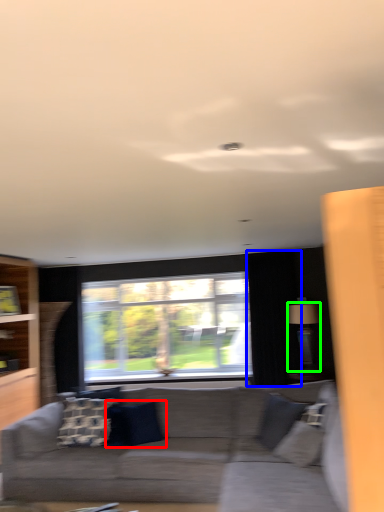
Question: Considering the real-world distances, which object is farthest from pillow (highlighted by a red box)? curtain (highlighted by a blue box) or lamp (highlighted by a green box)?

Choices:
 (A) curtain
 (B) lamp

Answer: (B)